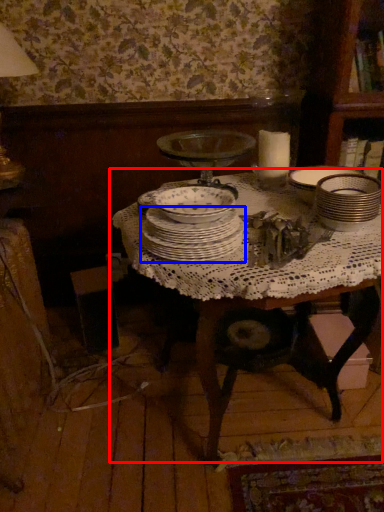
Question: Which object appears farthest to the camera in this image, table (highlighted by a red box) or plate (highlighted by a blue box)?

Choices:
 (A) table
 (B) plate

Answer: (B)